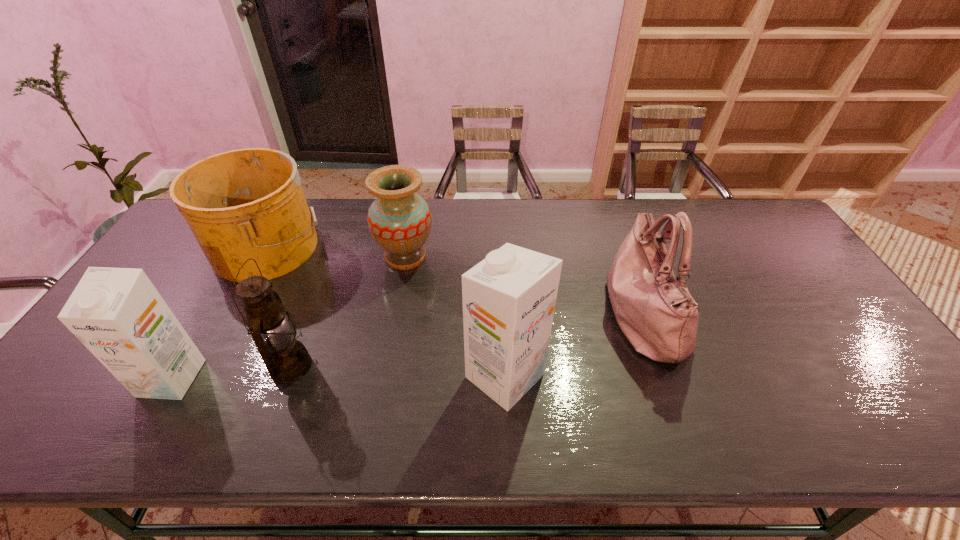
This screenshot has height=540, width=960. Find the location of `vacant space located 0.140m at the front of the handbag with handles`. vacant space located 0.140m at the front of the handbag with handles is located at coordinates (554, 314).

Where is `free space located at the front of the handbag with handles`? Image resolution: width=960 pixels, height=540 pixels. free space located at the front of the handbag with handles is located at coordinates (568, 314).

Identify the location of blank space located at the front of the handbag with handles. (507, 314).

The width and height of the screenshot is (960, 540). I want to click on vacant space located on the right of the bucket, so click(x=420, y=246).

Where is `vacant space located on the back of the oil lamp`? The height and width of the screenshot is (540, 960). vacant space located on the back of the oil lamp is located at coordinates (327, 268).

Find the location of `vase situated at the far edge`. vase situated at the far edge is located at coordinates (399, 220).

Find the location of a particular element. The image size is (960, 540). bucket located at the far edge is located at coordinates (247, 203).

Identify the location of handbag located at the near edge. The height and width of the screenshot is (540, 960). pyautogui.click(x=655, y=311).

Where is `oil lamp at the near edge`? The image size is (960, 540). oil lamp at the near edge is located at coordinates (286, 359).

Find the location of a particular element. The image size is (960, 540). object that is positioned at the left edge is located at coordinates (247, 203).